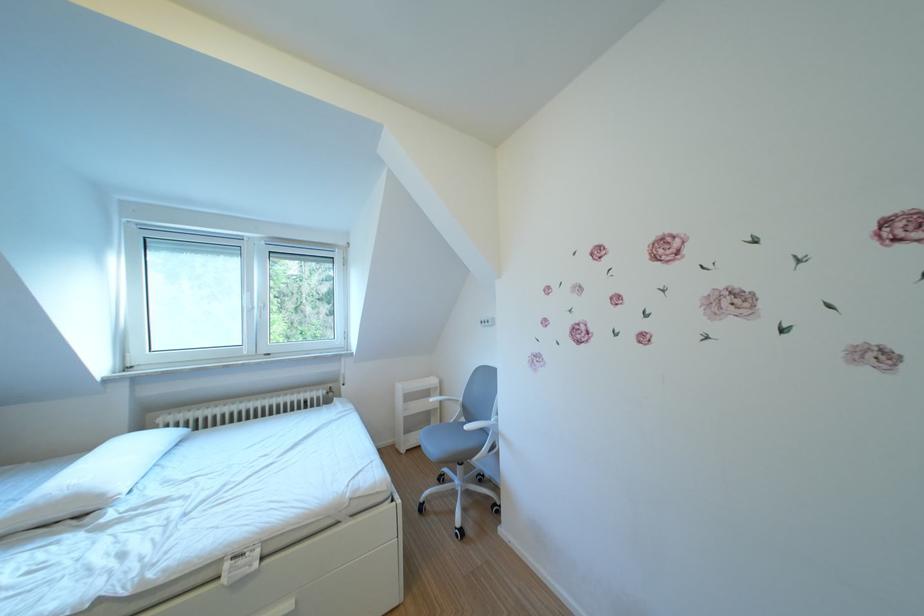
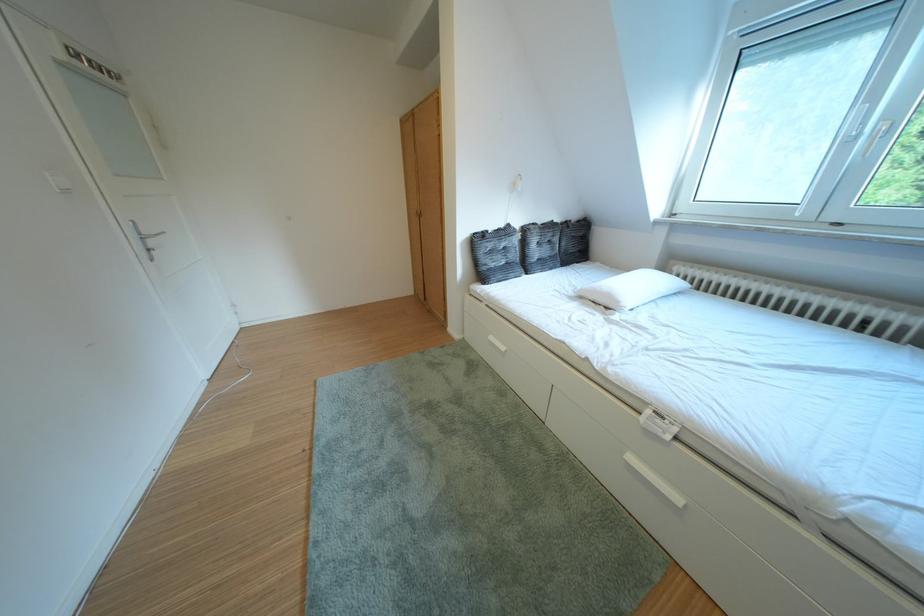
Find the pixel in the second image that matches the point at 91,501 in the first image.

(623, 301)